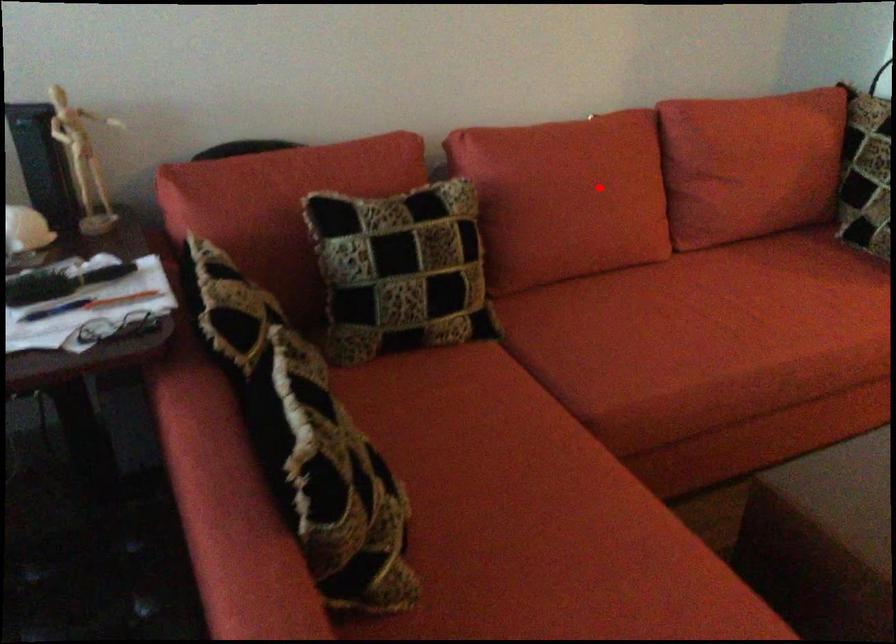
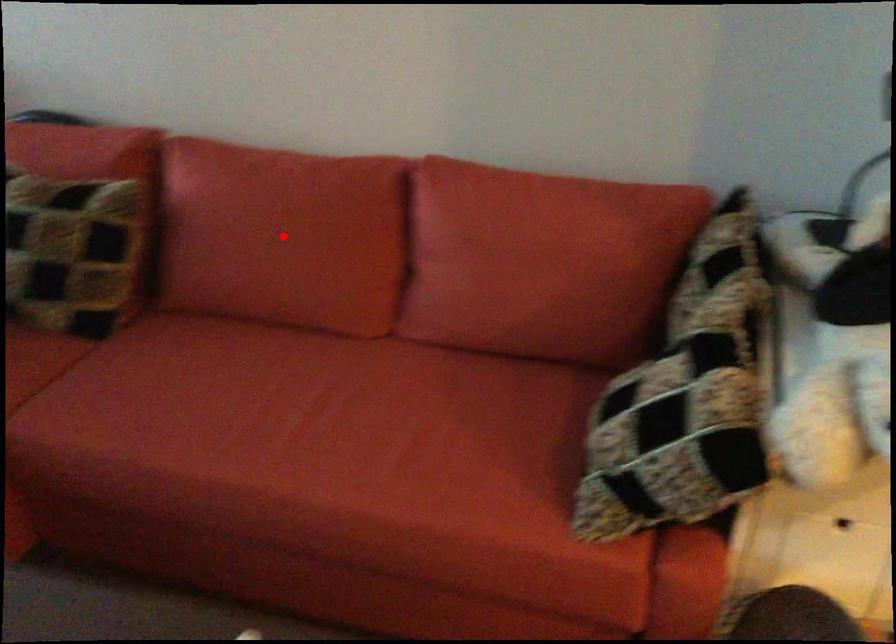
I am providing you with two images of the same scene from different viewpoints. A red point is marked on the first image and another point is marked on the second image. Does the point marked in image1 correspond to the same location as the one in image2?

Yes